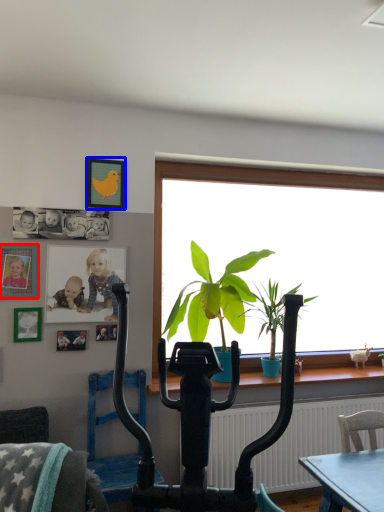
Question: Which point is further to the camera, picture frame (highlighted by a red box) or picture frame (highlighted by a blue box)?

Choices:
 (A) picture frame
 (B) picture frame

Answer: (B)